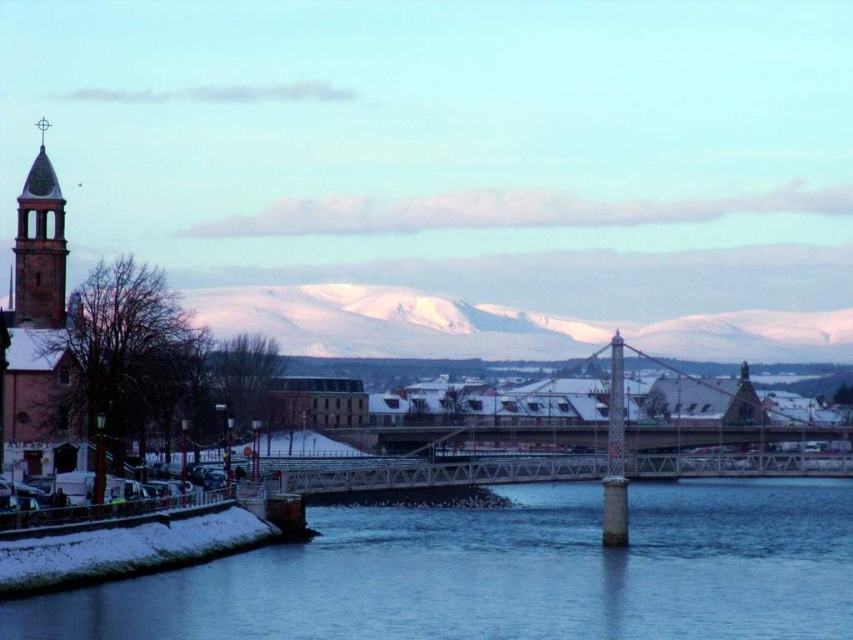
Where is `clear water at lower center`? clear water at lower center is located at coordinates (505, 573).

Does clear water at lower center appear on the right side of matte brick church steeple at left?

Yes, clear water at lower center is to the right of matte brick church steeple at left.

Who is more forward, (583, 579) or (32, 419)?

Positioned in front is point (583, 579).

This screenshot has height=640, width=853. I want to click on clear water at lower center, so click(505, 573).

Which is more to the right, clear water at lower center or snow-covered mountain at center?

From the viewer's perspective, clear water at lower center appears more on the right side.

Can you confirm if clear water at lower center is shorter than snow-covered mountain at center?

Yes.

Is point (277, 572) positioned behind point (824, 344)?

No, it is in front of (824, 344).

Identify the location of clear water at lower center. The width and height of the screenshot is (853, 640). (505, 573).

Describe the element at coordinates (500, 326) in the screenshot. I see `snow-covered mountain at center` at that location.

Is snow-covered mountain at center further to the viewer compared to matte brick church steeple at left?

That is True.

The image size is (853, 640). Find the location of `snow-covered mountain at center`. snow-covered mountain at center is located at coordinates (500, 326).